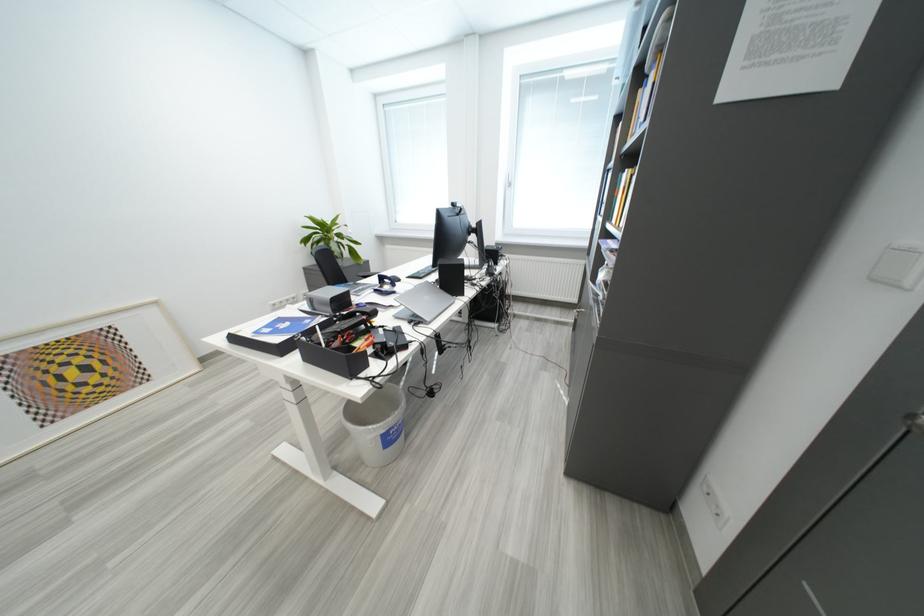
Locate an element on the screen. black desk tray is located at coordinates (338, 342).